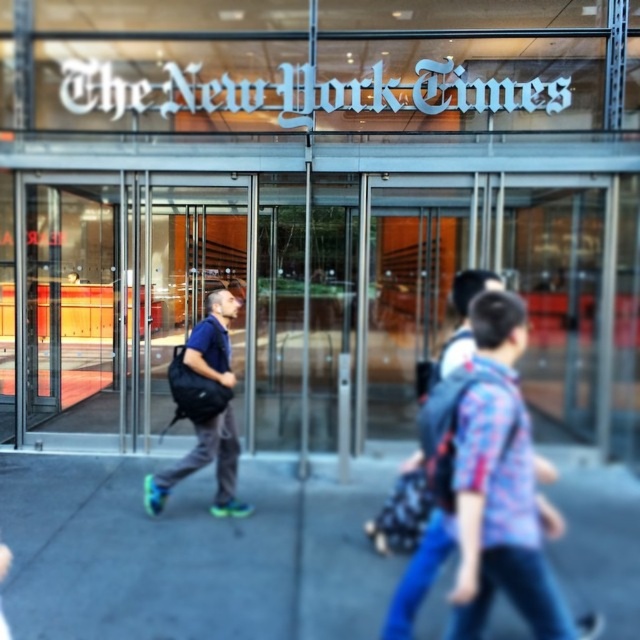
Does gray concrete sidewalk at center appear on the right side of transparent glass door at center?

Indeed, gray concrete sidewalk at center is positioned on the right side of transparent glass door at center.

Who is more forward, (129, 625) or (80, 266)?

Point (129, 625) is more forward.

At what (x,y) coordinates should I click in order to perform the action: click on gray concrete sidewalk at center. Please return your answer as a coordinate pair (x, y). Image resolution: width=640 pixels, height=640 pixels. Looking at the image, I should click on (141, 552).

Who is positioned more to the left, gray concrete sidewalk at center or black backpack at center?

From the viewer's perspective, black backpack at center appears more on the left side.

Is gray concrete sidewalk at center wider than black backpack at center?

Yes.

The image size is (640, 640). Describe the element at coordinates (141, 552) in the screenshot. I see `gray concrete sidewalk at center` at that location.

Locate an element on the screen. gray concrete sidewalk at center is located at coordinates (141, 552).

Does point (214, 232) lie in front of point (212, 321)?

That is False.

Is black backpack at center below matte black backpack at center?

No.

Does point (212, 257) come behind point (232, 481)?

Yes.

You are a GUI agent. You are given a task and a screenshot of the screen. Output one action in this format:
    pyautogui.click(x=<x>, y=<y>)
    Task: Click on the black backpack at center
    This screenshot has width=640, height=640.
    Given the screenshot: What is the action you would take?
    pyautogui.click(x=184, y=273)